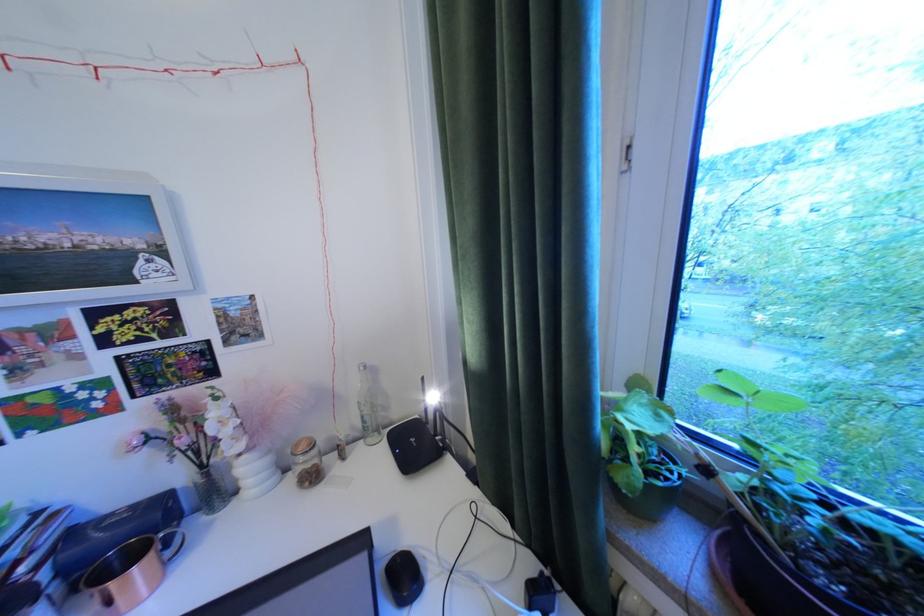
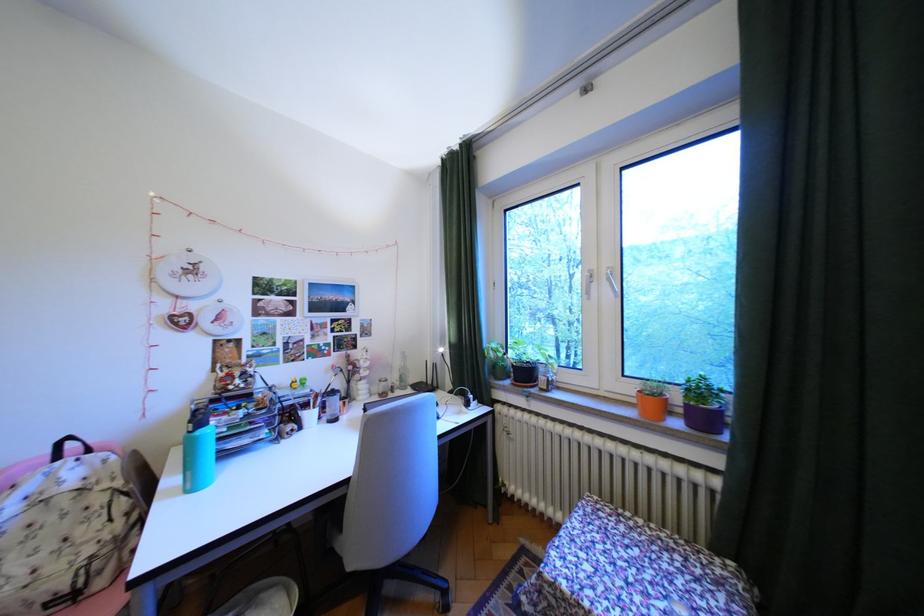
The point at (359, 424) is marked in the first image. Where is the corresponding point in the second image?

(407, 379)